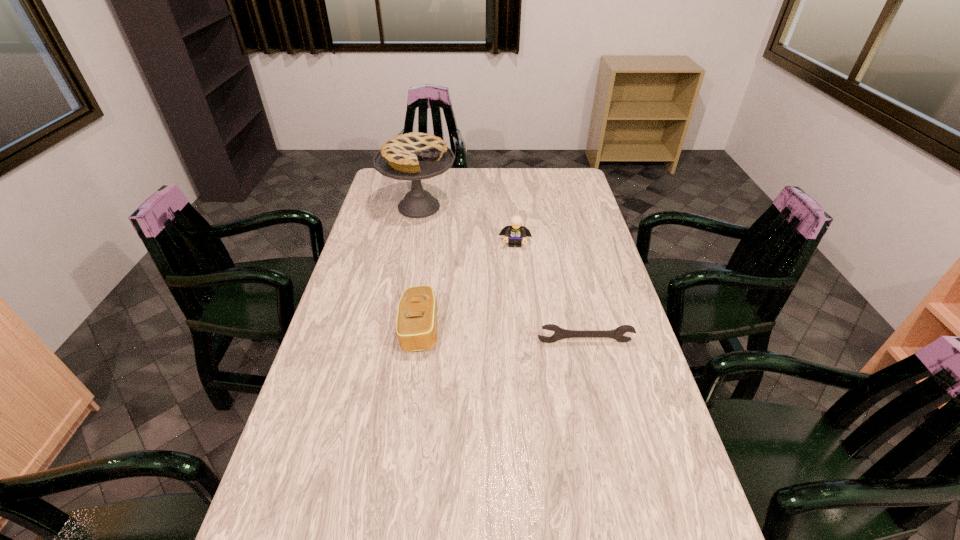
Identify the location of vacant space situated on the front-facing side of the Lego. The width and height of the screenshot is (960, 540). (513, 312).

Find the location of `vacant space positioned 0.270m on the cut side of the pie`. vacant space positioned 0.270m on the cut side of the pie is located at coordinates (463, 266).

Find the location of a particular element. The width and height of the screenshot is (960, 540). free space located on the cut side of the pie is located at coordinates (444, 241).

You are a GUI agent. You are given a task and a screenshot of the screen. Output one action in this format:
    pyautogui.click(x=<x>, y=<y>)
    Task: Click on the vacant space located on the cut side of the pie
    
    Given the screenshot: What is the action you would take?
    pyautogui.click(x=450, y=248)

The width and height of the screenshot is (960, 540). Find the location of `object situated at the far edge`. object situated at the far edge is located at coordinates (412, 156).

This screenshot has width=960, height=540. What are the coordinates of `object located in the left edge section of the desktop` in the screenshot? It's located at (412, 156).

Image resolution: width=960 pixels, height=540 pixels. Identify the location of object that is at the right edge. (560, 333).

This screenshot has height=540, width=960. I want to click on object that is at the far left corner, so [x=412, y=156].

This screenshot has height=540, width=960. In order to click on vacant space at the far edge of the desktop in this screenshot , I will do `click(488, 194)`.

Find the location of `vacant space at the left edge of the desktop`. vacant space at the left edge of the desktop is located at coordinates (355, 253).